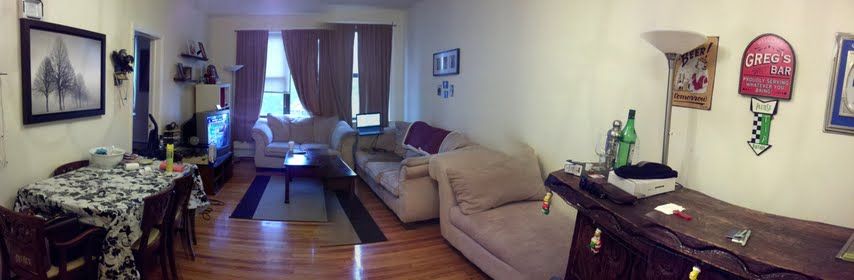
What are the coordinates of `windows` in the screenshot? It's located at (281, 80), (295, 97), (353, 93).